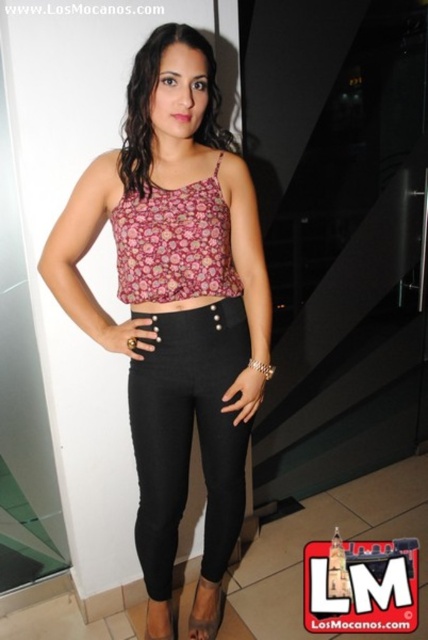
You are a photographer adjusting your camera settings. You notice the floral fabric top at center and the black leather sandal at lower center. Which object should you focus on first to ensure it appears sharp in the photo?

The floral fabric top at center is closer to the viewer than the black leather sandal at lower center, so you should focus on the floral fabric top at center first to ensure it appears sharp.

You are a fashion designer analyzing the outfit of the person in the image. Which item, the floral fabric top at center or the leather sandal at lower center, would you say is more prominent in the outfit based on their sizes?

The floral fabric top at center is more prominent in the outfit because it has a larger size compared to the leather sandal at lower center.